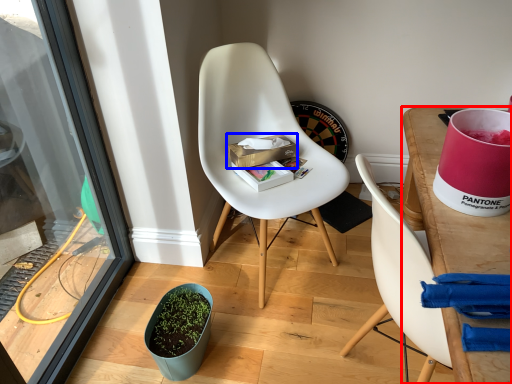
Question: Which object appears farthest to the camera in this image, desk (highlighted by a red box) or box (highlighted by a blue box)?

Choices:
 (A) desk
 (B) box

Answer: (B)